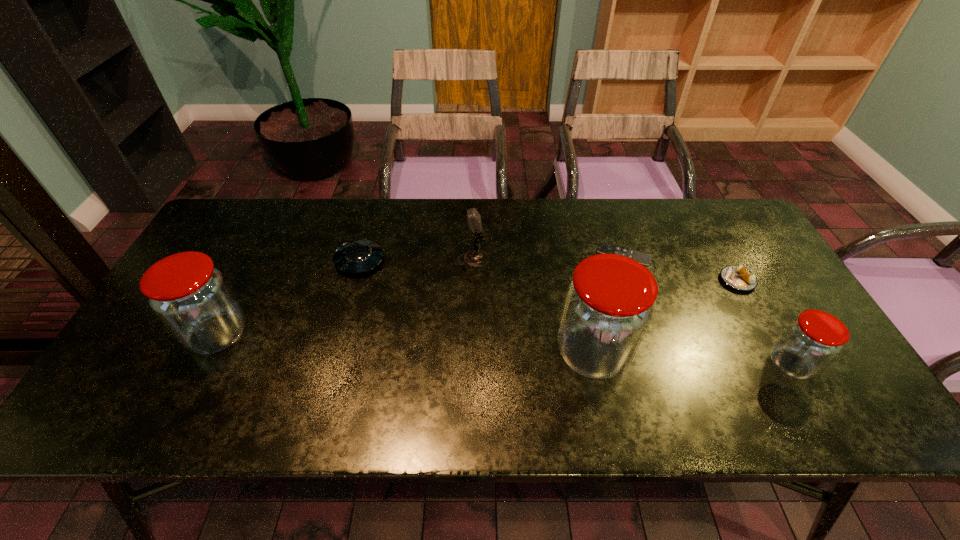
To achieve uniform spacing by inserting another jar among them, please point to a free space for this new jar. Please provide its 2D coordinates. Your answer should be formatted as a tuple, i.e. [(x, y)], where the tuple contains the x and y coordinates of a point satisfying the conditions above.

[(402, 345)]